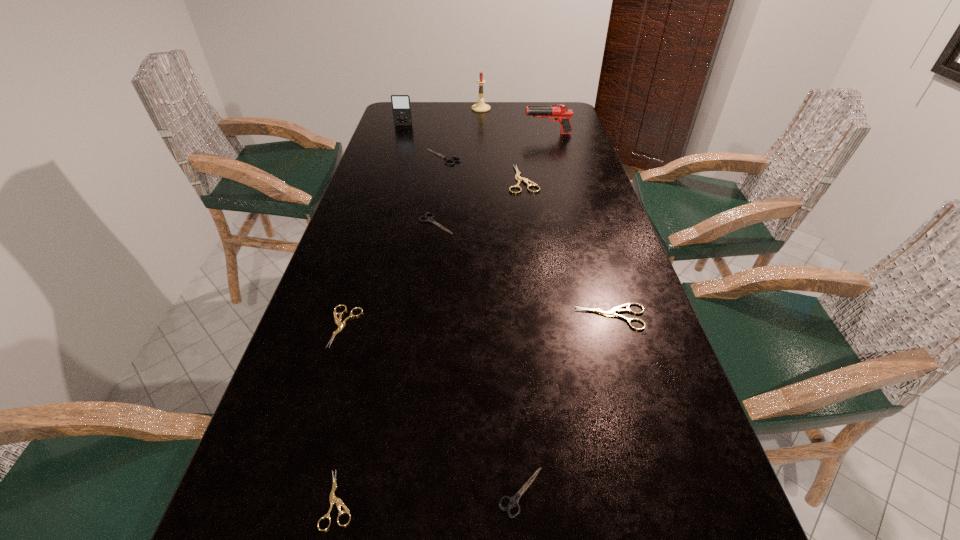
Locate an element on the screen. The image size is (960, 540). the rightmost shears is located at coordinates (612, 312).

This screenshot has width=960, height=540. What are the coordinates of `the rightmost beige shears` in the screenshot? It's located at (612, 312).

The image size is (960, 540). I want to click on the leftmost beige shears, so click(x=341, y=325).

Find the location of a particular element. The image size is (960, 540). the second smallest beige shears is located at coordinates (341, 325).

This screenshot has height=540, width=960. I want to click on the nearest black shears, so click(x=513, y=501).

You are a GUI agent. You are given a task and a screenshot of the screen. Output one action in this format:
    pyautogui.click(x=<x>, y=<y>)
    Task: Click on the smallest black shears
    The height and width of the screenshot is (540, 960).
    Given the screenshot: What is the action you would take?
    pyautogui.click(x=513, y=501)

At what (x,y) coordinates should I click in order to perform the action: click on the shortest object. Please return your answer as a coordinate pair (x, y). The image size is (960, 540). Looking at the image, I should click on (333, 499).

The image size is (960, 540). Identify the location of the third beige shears from right to left. (333, 499).

At what (x,y) coordinates should I click in order to perform the action: click on vacant position located 0.370m on the front of the red candle. Please return your answer as a coordinate pair (x, y). This screenshot has width=960, height=540. Looking at the image, I should click on click(481, 154).

The image size is (960, 540). I want to click on blank area located on the front-facing side of the second farthest object, so click(x=390, y=168).